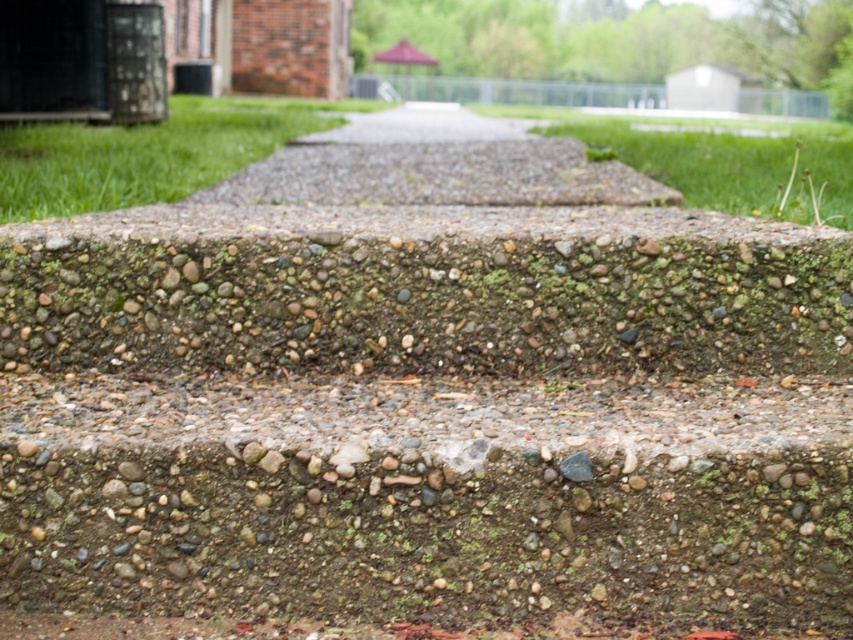
Question: Considering the relative positions of green grass at upper left and green grass at center in the image provided, where is green grass at upper left located with respect to green grass at center?

Choices:
 (A) below
 (B) above

Answer: (B)

Question: Which of the following is the farthest from the observer?

Choices:
 (A) (410, 136)
 (B) (790, 195)
 (C) (194, 150)

Answer: (A)

Question: Is green grass at upper left thinner than green grass at center?

Choices:
 (A) no
 (B) yes

Answer: (B)

Question: Among these objects, which one is nearest to the camera?

Choices:
 (A) green grass at center
 (B) green grass at upper left

Answer: (B)

Question: Which of the following is the closest to the observer?

Choices:
 (A) green grass at center
 (B) green grass at upper left
 (C) pebble concrete pavement at center

Answer: (B)

Question: Can you confirm if green grass at center is thinner than pebble concrete pavement at center?

Choices:
 (A) yes
 (B) no

Answer: (B)